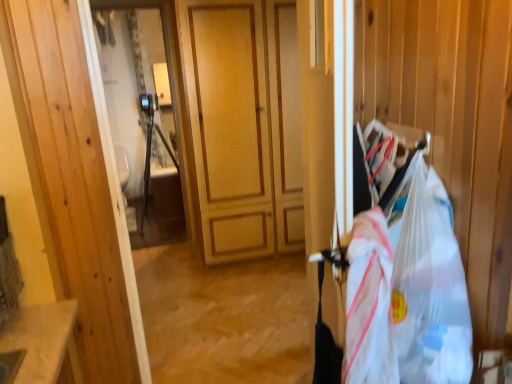
Question: In the image, is clear plastic grocery bag at right, arranged as the 2th grocery bag when viewed from the left, on the left side or the right side of white plastic bag at right, which is counted as the 1th grocery bag, starting from the left?

Choices:
 (A) right
 (B) left

Answer: (A)

Question: From a real-world perspective, relative to white plastic bag at right, the 2th grocery bag in the right-to-left sequence, is clear plastic grocery bag at right, the first grocery bag from the right, vertically above or below?

Choices:
 (A) above
 (B) below

Answer: (A)

Question: Considering the positions of clear plastic grocery bag at right, the first grocery bag from the right, and white plastic bag at right, which is counted as the 1th grocery bag, starting from the left, in the image, is clear plastic grocery bag at right, the first grocery bag from the right, bigger or smaller than white plastic bag at right, which is counted as the 1th grocery bag, starting from the left,?

Choices:
 (A) big
 (B) small

Answer: (A)

Question: Is white plastic bag at right, which is counted as the 1th grocery bag, starting from the left, situated inside clear plastic grocery bag at right, arranged as the 2th grocery bag when viewed from the left, or outside?

Choices:
 (A) inside
 (B) outside

Answer: (B)

Question: In terms of width, does white plastic bag at right, which is counted as the 1th grocery bag, starting from the left, look wider or thinner when compared to clear plastic grocery bag at right, the first grocery bag from the right?

Choices:
 (A) thin
 (B) wide

Answer: (A)

Question: From the image's perspective, relative to clear plastic grocery bag at right, arranged as the 2th grocery bag when viewed from the left, is white plastic bag at right, which is counted as the 1th grocery bag, starting from the left, above or below?

Choices:
 (A) below
 (B) above

Answer: (A)

Question: In the image, is white plastic bag at right, which is counted as the 1th grocery bag, starting from the left, positioned in front of or behind clear plastic grocery bag at right, the first grocery bag from the right?

Choices:
 (A) behind
 (B) front

Answer: (A)